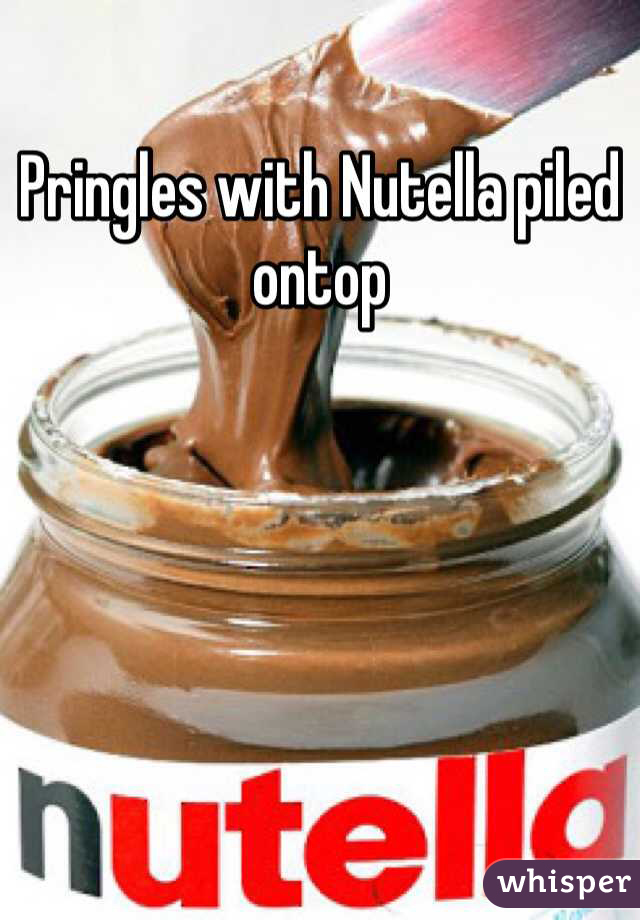
Identify the location of jar. This screenshot has height=920, width=640. 332,674.